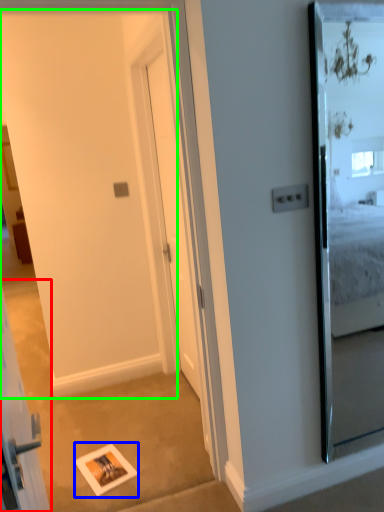
Question: Considering the real-world distances, which object is farthest from elevator (highlighted by a red box)? picture frame (highlighted by a blue box) or barn door (highlighted by a green box)?

Choices:
 (A) picture frame
 (B) barn door

Answer: (B)